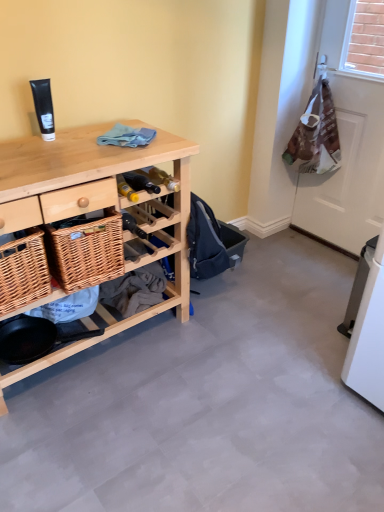
Where is `free space in front of blue cotton cloth at center`? This screenshot has height=512, width=384. free space in front of blue cotton cloth at center is located at coordinates (111, 151).